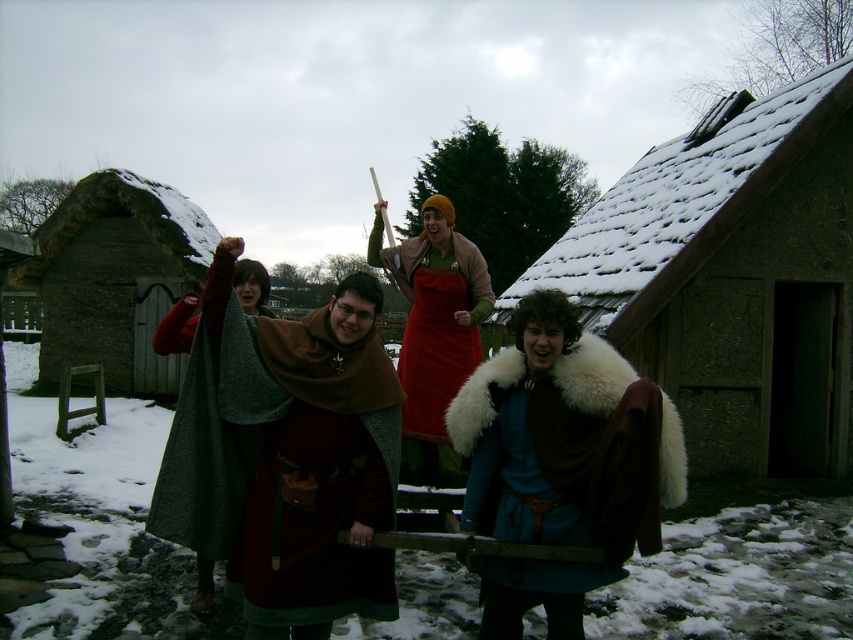
Question: Which is farther from the dark brown wooden hut at left?

Choices:
 (A) brown woolen cape at center
 (B) rustic stone hut at center
 (C) velvet red dress at center

Answer: (B)

Question: Does brown fur-lined cloak at center appear on the left side of dark brown wooden hut at left?

Choices:
 (A) yes
 (B) no

Answer: (B)

Question: Is brown woolen cape at center thinner than velvet red dress at center?

Choices:
 (A) no
 (B) yes

Answer: (A)

Question: Which is farther from the brown fur-lined cloak at center?

Choices:
 (A) velvet red dress at center
 (B) rustic stone hut at center

Answer: (B)

Question: Which object appears farthest from the camera in this image?

Choices:
 (A) rustic stone hut at center
 (B) brown fur-lined cloak at center
 (C) brown woolen cape at center
 (D) dark brown wooden hut at left

Answer: (D)

Question: Can you confirm if rustic stone hut at center is positioned below brown woolen cape at center?

Choices:
 (A) no
 (B) yes

Answer: (B)